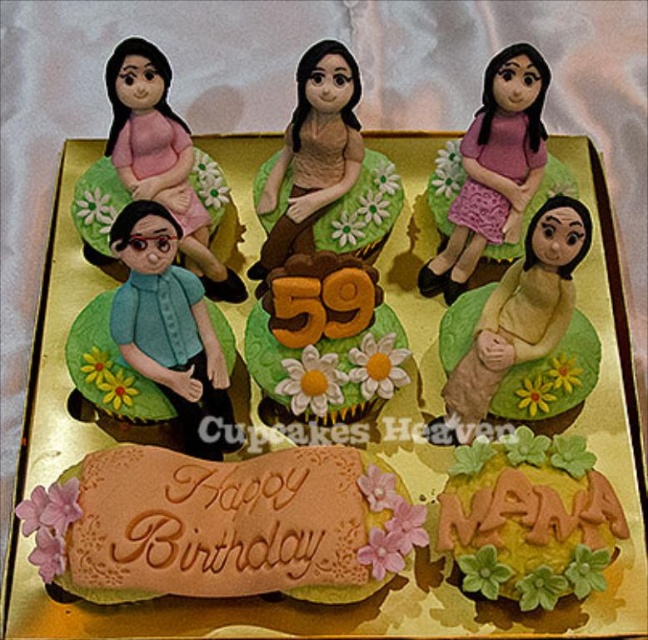
Which is behind, point (567, 454) or point (527, 168)?

The point (527, 168) is behind.

Can you confirm if yellow fondant cake at lower right is thinner than pink fabric doll at upper center?

No, yellow fondant cake at lower right is not thinner than pink fabric doll at upper center.

The height and width of the screenshot is (640, 648). What do you see at coordinates (527, 518) in the screenshot?
I see `yellow fondant cake at lower right` at bounding box center [527, 518].

The height and width of the screenshot is (640, 648). I want to click on yellow fondant cake at lower right, so click(527, 518).

Between brown fondant number at center and matte pink fabric doll at upper left, which one is positioned lower?

brown fondant number at center is below.

Based on the photo, is brown fondant number at center positioned at the back of matte pink fabric doll at upper left?

No, brown fondant number at center is in front of matte pink fabric doll at upper left.

Is point (364, 358) behind point (111, 140)?

No.

Locate an element on the screen. The width and height of the screenshot is (648, 640). brown fondant number at center is located at coordinates coord(324,340).

Is brown fondant number at center in front of pink fabric doll at upper center?

Yes, it is in front of pink fabric doll at upper center.

Can you confirm if brown fondant number at center is wider than pink fabric doll at upper center?

Correct, the width of brown fondant number at center exceeds that of pink fabric doll at upper center.

The image size is (648, 640). I want to click on brown fondant number at center, so click(x=324, y=340).